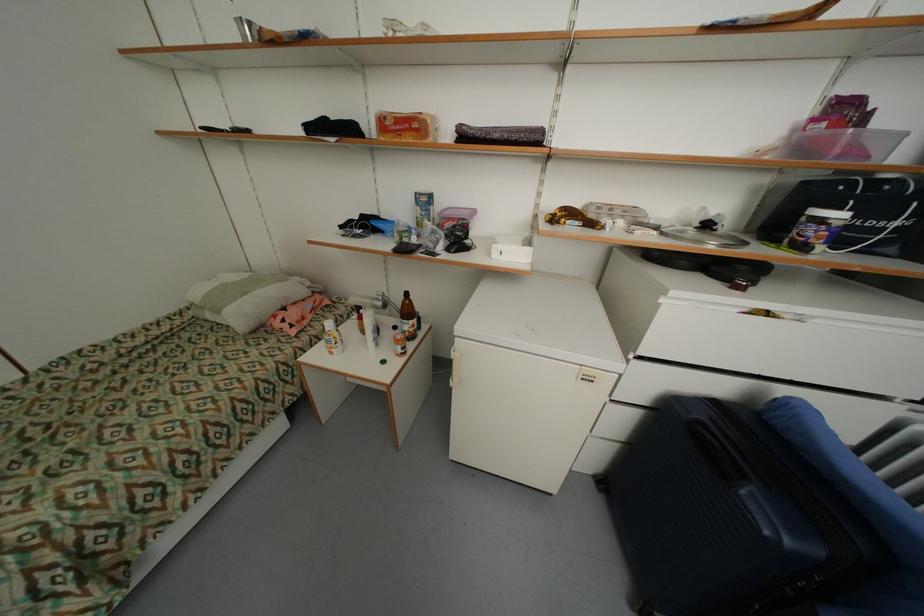
Identify the location of white plastic bottle. This screenshot has width=924, height=616. (332, 338).